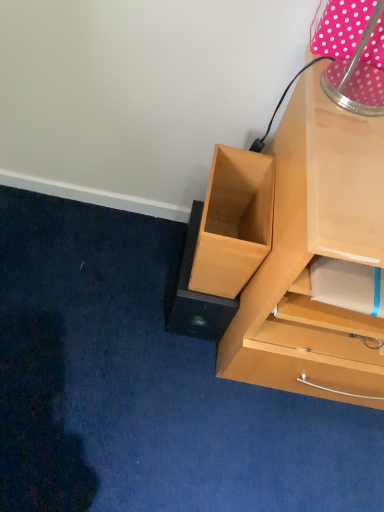
Question: Considering the relative positions of pink polka dot fabric at upper right and brown cardboard drawer at lower left in the image provided, is pink polka dot fabric at upper right to the left or to the right of brown cardboard drawer at lower left?

Choices:
 (A) right
 (B) left

Answer: (A)

Question: From the image's perspective, is pink polka dot fabric at upper right above or below brown cardboard drawer at lower left?

Choices:
 (A) above
 (B) below

Answer: (A)

Question: Do you think pink polka dot fabric at upper right is within brown cardboard drawer at lower left, or outside of it?

Choices:
 (A) outside
 (B) inside

Answer: (A)

Question: In terms of width, does brown cardboard drawer at lower left look wider or thinner when compared to pink polka dot fabric at upper right?

Choices:
 (A) wide
 (B) thin

Answer: (A)

Question: From the image's perspective, relative to pink polka dot fabric at upper right, is brown cardboard drawer at lower left above or below?

Choices:
 (A) below
 (B) above

Answer: (A)

Question: Considering their positions, is brown cardboard drawer at lower left located in front of or behind pink polka dot fabric at upper right?

Choices:
 (A) behind
 (B) front

Answer: (A)

Question: Considering the positions of point (233, 287) and point (332, 72), is point (233, 287) closer or farther from the camera than point (332, 72)?

Choices:
 (A) closer
 (B) farther

Answer: (B)